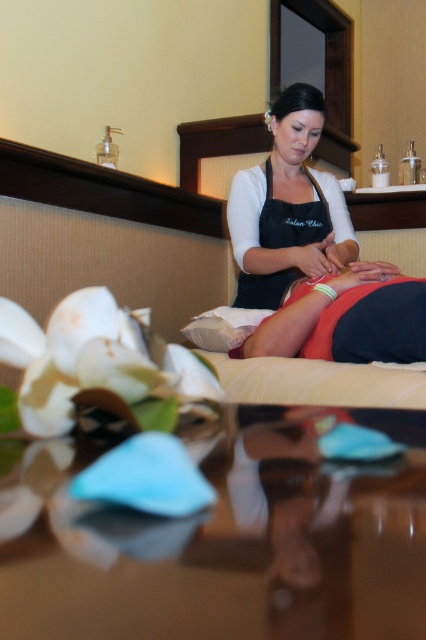
Question: Which point is farther to the camera?

Choices:
 (A) black fabric apron at center
 (B) black matte apron at center

Answer: (A)

Question: Does black matte apron at center appear on the right side of black fabric apron at center?

Choices:
 (A) no
 (B) yes

Answer: (B)

Question: Is black matte apron at center bigger than black fabric apron at center?

Choices:
 (A) yes
 (B) no

Answer: (A)

Question: Can you confirm if black matte apron at center is positioned to the left of black fabric apron at center?

Choices:
 (A) yes
 (B) no

Answer: (B)